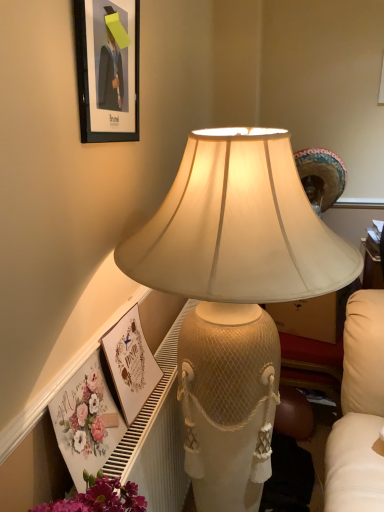
Question: Considering the relative sizes of matte white picture frame at lower center, the 1th picture frame positioned from the bottom, and matte black frame at upper left, which is the 1th picture frame in top-to-bottom order, in the image provided, is matte white picture frame at lower center, the 1th picture frame positioned from the bottom, bigger than matte black frame at upper left, which is the 1th picture frame in top-to-bottom order,?

Choices:
 (A) yes
 (B) no

Answer: (A)

Question: Can you see matte white picture frame at lower center, the 1th picture frame positioned from the bottom, touching matte black frame at upper left, acting as the second picture frame starting from the bottom?

Choices:
 (A) no
 (B) yes

Answer: (A)

Question: Can we say matte white picture frame at lower center, the 1th picture frame positioned from the bottom, lies outside matte black frame at upper left, acting as the second picture frame starting from the bottom?

Choices:
 (A) yes
 (B) no

Answer: (A)

Question: Would you say matte black frame at upper left, which is the 1th picture frame in top-to-bottom order, is part of matte white picture frame at lower center, the second picture frame positioned from the top,'s contents?

Choices:
 (A) yes
 (B) no

Answer: (B)

Question: Is matte white picture frame at lower center, the 1th picture frame positioned from the bottom, to the right of matte black frame at upper left, acting as the second picture frame starting from the bottom, from the viewer's perspective?

Choices:
 (A) yes
 (B) no

Answer: (A)

Question: Relative to matte white picture frame at lower center, the second picture frame positioned from the top, is matte cream lampshade at center in front or behind?

Choices:
 (A) behind
 (B) front

Answer: (B)

Question: Is matte cream lampshade at center taller or shorter than matte white picture frame at lower center, the second picture frame positioned from the top?

Choices:
 (A) short
 (B) tall

Answer: (B)

Question: Is point (173, 263) closer or farther from the camera than point (142, 406)?

Choices:
 (A) closer
 (B) farther

Answer: (A)

Question: From a real-world perspective, is matte cream lampshade at center positioned above or below matte white picture frame at lower center, the 1th picture frame positioned from the bottom?

Choices:
 (A) above
 (B) below

Answer: (B)

Question: Is point (97, 10) positioned closer to the camera than point (233, 294)?

Choices:
 (A) closer
 (B) farther

Answer: (B)

Question: Is matte black frame at upper left, acting as the second picture frame starting from the bottom, spatially inside matte cream lampshade at center, or outside of it?

Choices:
 (A) inside
 (B) outside

Answer: (B)

Question: Is matte black frame at upper left, which is the 1th picture frame in top-to-bottom order, taller or shorter than matte cream lampshade at center?

Choices:
 (A) tall
 (B) short

Answer: (B)

Question: In terms of size, does matte black frame at upper left, acting as the second picture frame starting from the bottom, appear bigger or smaller than matte cream lampshade at center?

Choices:
 (A) big
 (B) small

Answer: (B)

Question: Would you say matte white picture frame at lower center, the 1th picture frame positioned from the bottom, is to the left or to the right of matte cream lampshade at center in the picture?

Choices:
 (A) right
 (B) left

Answer: (B)

Question: Considering the positions of matte white picture frame at lower center, the 1th picture frame positioned from the bottom, and matte cream lampshade at center in the image, is matte white picture frame at lower center, the 1th picture frame positioned from the bottom, taller or shorter than matte cream lampshade at center?

Choices:
 (A) tall
 (B) short

Answer: (B)